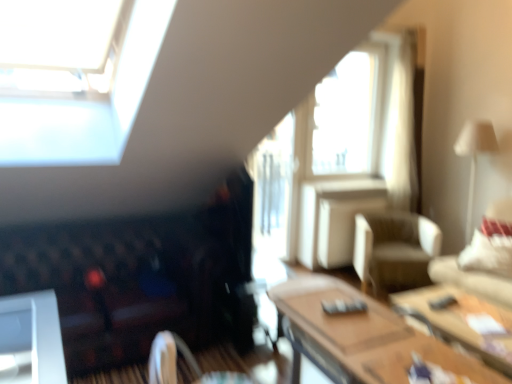
Question: Which direction should I rotate to look at velvet dark brown swivel chair at lower center, placed as the first swivel chair when sorted from left to right, — up or down?

Choices:
 (A) down
 (B) up

Answer: (A)

Question: Is white fabric lampshade at upper right a part of velvet dark brown swivel chair at lower center, which appears as the 2th swivel chair when viewed from the right?

Choices:
 (A) no
 (B) yes

Answer: (A)

Question: Considering the relative positions of velvet dark brown swivel chair at lower center, which is the second swivel chair from back to front, and white fabric lampshade at upper right in the image provided, is velvet dark brown swivel chair at lower center, which is the second swivel chair from back to front, behind white fabric lampshade at upper right?

Choices:
 (A) yes
 (B) no

Answer: (B)

Question: Does velvet dark brown swivel chair at lower center, which is the second swivel chair from back to front, have a greater width compared to white fabric lampshade at upper right?

Choices:
 (A) no
 (B) yes

Answer: (B)

Question: Is velvet dark brown swivel chair at lower center, which appears as the 2th swivel chair when viewed from the right, next to white fabric lampshade at upper right and touching it?

Choices:
 (A) yes
 (B) no

Answer: (B)

Question: Does velvet dark brown swivel chair at lower center, which appears as the 2th swivel chair when viewed from the right, have a lesser width compared to white fabric lampshade at upper right?

Choices:
 (A) no
 (B) yes

Answer: (A)

Question: Can you confirm if velvet dark brown swivel chair at lower center, the 1th swivel chair viewed from the front, is positioned to the right of white fabric lampshade at upper right?

Choices:
 (A) no
 (B) yes

Answer: (A)

Question: Is velvet dark brown futon at lower left shorter than wooden table at lower right, positioned as the second table in left-to-right order?

Choices:
 (A) no
 (B) yes

Answer: (A)

Question: Considering the relative sizes of velvet dark brown futon at lower left and wooden table at lower right, which is the first table from back to front, in the image provided, is velvet dark brown futon at lower left thinner than wooden table at lower right, which is the first table from back to front,?

Choices:
 (A) yes
 (B) no

Answer: (B)

Question: Considering the relative sizes of velvet dark brown futon at lower left and wooden table at lower right, which is the first table from back to front, in the image provided, is velvet dark brown futon at lower left wider than wooden table at lower right, which is the first table from back to front,?

Choices:
 (A) yes
 (B) no

Answer: (A)

Question: Is velvet dark brown futon at lower left beside wooden table at lower right, which is the first table from back to front?

Choices:
 (A) no
 (B) yes

Answer: (A)

Question: Is the depth of velvet dark brown futon at lower left less than that of wooden table at lower right, which is the first table from back to front?

Choices:
 (A) no
 (B) yes

Answer: (A)

Question: From the image's perspective, is velvet dark brown futon at lower left on top of wooden table at lower right, positioned as the second table in left-to-right order?

Choices:
 (A) yes
 (B) no

Answer: (A)

Question: Is transparent glass window at upper center positioned beyond the bounds of beige fabric swivel chair at center, positioned as the second swivel chair in front-to-back order?

Choices:
 (A) no
 (B) yes

Answer: (B)